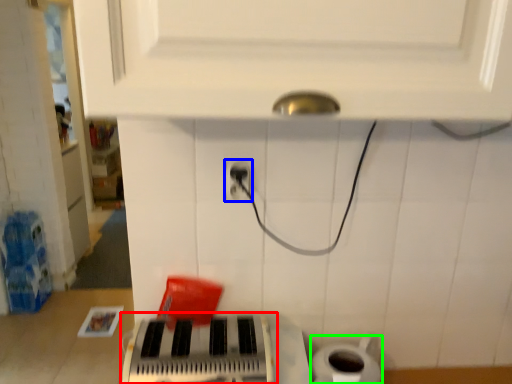
Question: Which object is the closest to the musical keyboard (highlighted by a red box)? Choose among these: power plugs and sockets (highlighted by a blue box) or toilet paper (highlighted by a green box).

Choices:
 (A) power plugs and sockets
 (B) toilet paper

Answer: (B)